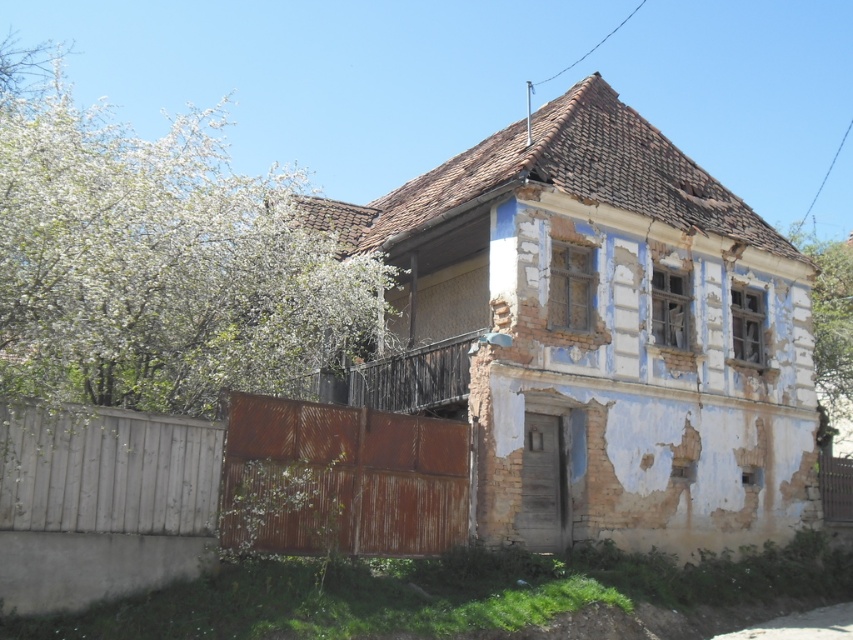
Does rusty corrugated metal fence at lower left have a lesser width compared to rusty metal gate at lower right?

No.

Between rusty corrugated metal fence at lower left and rusty metal gate at lower right, which one appears on the left side from the viewer's perspective?

Positioned to the left is rusty corrugated metal fence at lower left.

Which is in front, point (451, 429) or point (822, 465)?

Point (451, 429) is in front.

Locate an element on the screen. The width and height of the screenshot is (853, 640). rusty corrugated metal fence at lower left is located at coordinates (340, 480).

Can you confirm if white blossoms at upper left is bigger than white textured wall at upper right?

Yes, white blossoms at upper left is bigger than white textured wall at upper right.

Can you confirm if white blossoms at upper left is shorter than white textured wall at upper right?

No, white blossoms at upper left is not shorter than white textured wall at upper right.

Does point (247, 212) come closer to viewer compared to point (822, 365)?

Yes.

In order to click on white blossoms at upper left in this screenshot , I will do (163, 260).

Where is `rusty corrugated metal fence at lower left`? Image resolution: width=853 pixels, height=640 pixels. rusty corrugated metal fence at lower left is located at coordinates click(x=340, y=480).

This screenshot has width=853, height=640. What do you see at coordinates (340, 480) in the screenshot?
I see `rusty corrugated metal fence at lower left` at bounding box center [340, 480].

Is point (316, 404) closer to camera compared to point (819, 400)?

That is True.

This screenshot has height=640, width=853. Find the location of `rusty corrugated metal fence at lower left`. rusty corrugated metal fence at lower left is located at coordinates (340, 480).